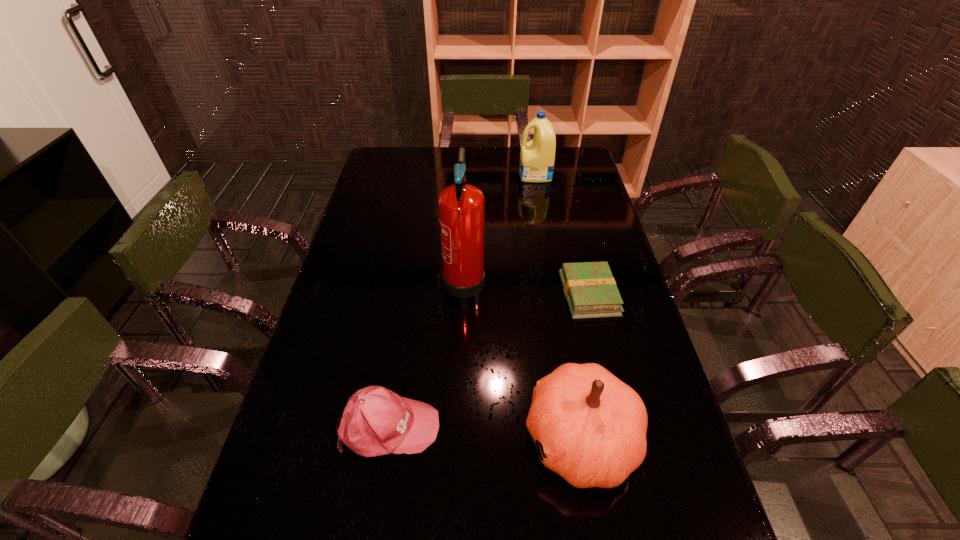
This screenshot has width=960, height=540. What are the coordinates of `fire extinguisher` in the screenshot? It's located at (461, 206).

Locate an element on the screen. The width and height of the screenshot is (960, 540). the farthest object is located at coordinates pos(537,156).

Identify the location of pumpkin. (592, 427).

The image size is (960, 540). I want to click on the fourth tallest object, so click(x=376, y=421).

The image size is (960, 540). In order to click on the shortest object in this screenshot , I will do `click(590, 290)`.

Where is `vacant space located on the right of the tallest object`? vacant space located on the right of the tallest object is located at coordinates (583, 275).

Where is `free space located 0.340m on the label of the farthest object`? The image size is (960, 540). free space located 0.340m on the label of the farthest object is located at coordinates click(437, 175).

In order to click on blank space located 0.120m on the label of the farthest object in this screenshot , I will do `click(490, 175)`.

Identify the location of free space located 0.350m on the label of the farthest object. (435, 175).

Where is `free space located 0.090m on the front-facing side of the pumpkin`? This screenshot has width=960, height=540. free space located 0.090m on the front-facing side of the pumpkin is located at coordinates click(x=485, y=439).